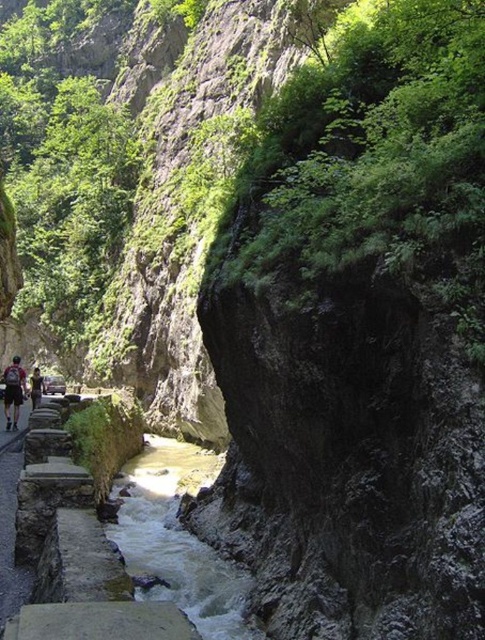
You are a hiker standing at the entrance of the canyon and see the dark gray backpack at left. If you want to reach the backpack, which direction should you move relative to the stream flowing through the canyon?

The dark gray backpack at left is located at point [14,392], which is to the left side of the stream. Therefore, you should move to the left relative to the stream to reach the dark gray backpack at left.

You are standing at the point with coordinates (14, 392) in the canyon. What object is located exactly at your current position?

The dark gray backpack at left is located exactly at the point with coordinates (14, 392).